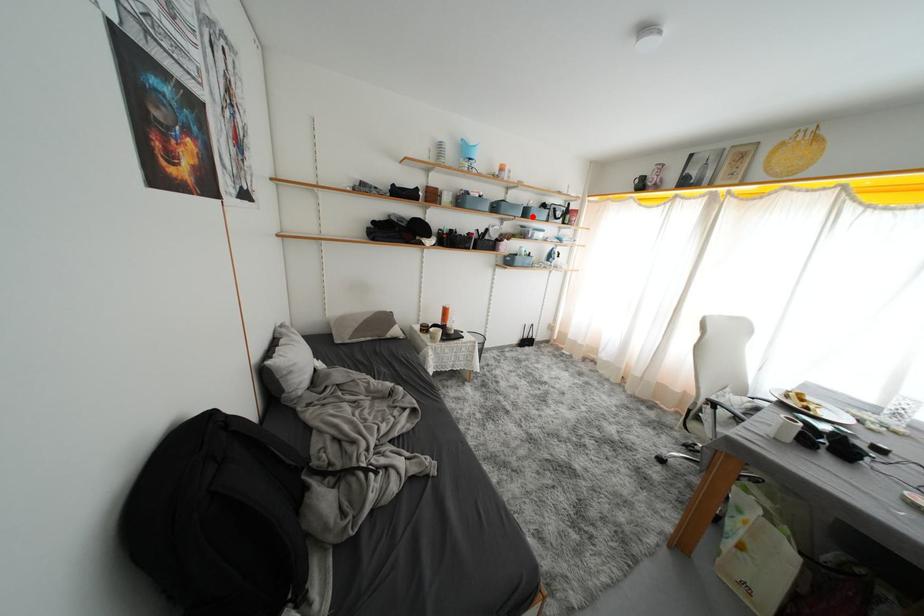
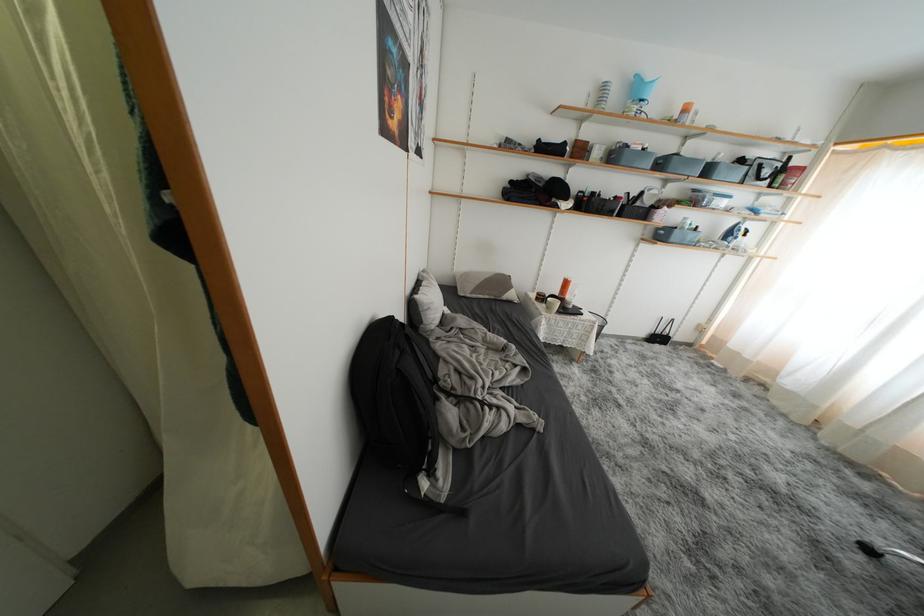
Where in the second image is the point corresponding to the highlighted location from the first image?

(714, 175)